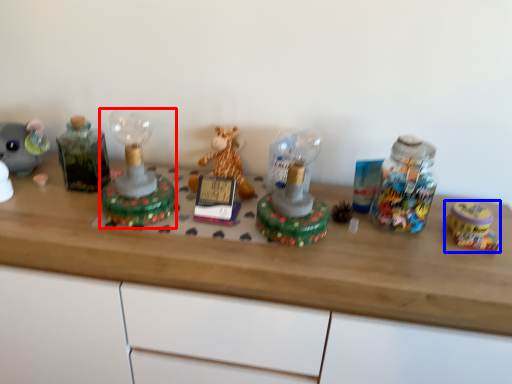
Question: Among these objects, which one is farthest to the camera, toy (highlighted by a red box) or toy (highlighted by a blue box)?

Choices:
 (A) toy
 (B) toy

Answer: (B)